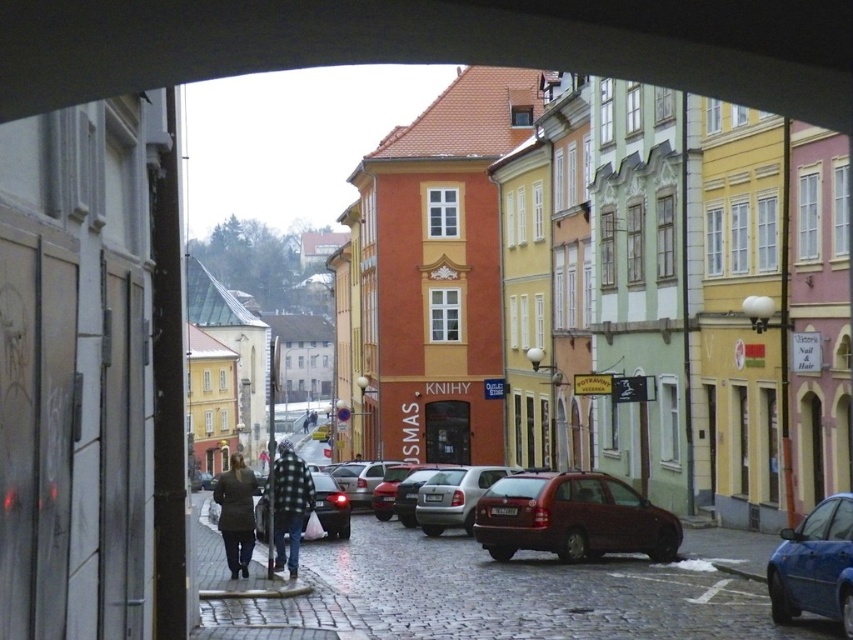
Question: Considering the relative positions of flannel shirt at center and matte black car at center in the image provided, where is flannel shirt at center located with respect to matte black car at center?

Choices:
 (A) above
 (B) below

Answer: (B)

Question: Can you confirm if flannel shirt at center is bigger than matte black car at center?

Choices:
 (A) yes
 (B) no

Answer: (A)

Question: Which of these objects is positioned farthest from the blue metallic car at lower right?

Choices:
 (A) dark green coat at lower left
 (B) matte black car at center
 (C) shiny red car at center
 (D) orange matte building at center

Answer: (D)

Question: Which point appears farthest from the camera in this image?

Choices:
 (A) (850, 604)
 (B) (393, 497)
 (C) (432, 502)

Answer: (B)

Question: Is orange matte building at center below flannel shirt at center?

Choices:
 (A) no
 (B) yes

Answer: (A)

Question: Which point is farther to the camera?

Choices:
 (A) tap(380, 461)
 (B) tap(305, 464)
 (C) tap(242, 506)
 (D) tap(631, 513)

Answer: (A)